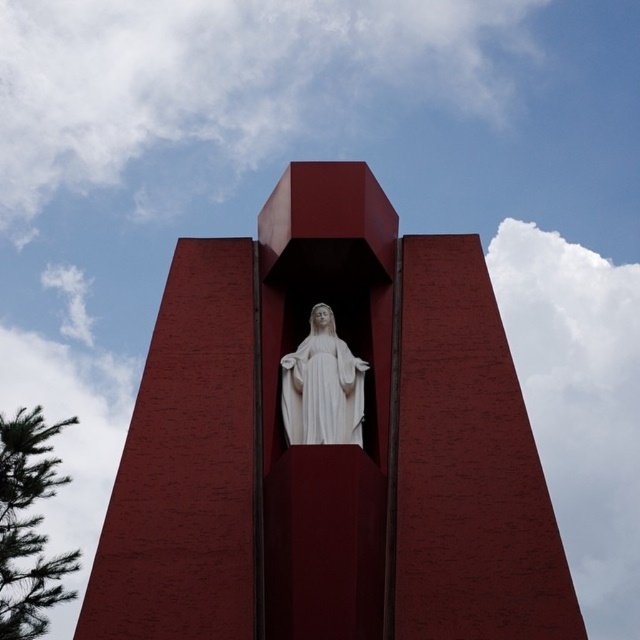
Can you confirm if matte red tower at center is smaller than white marble statue at center?

No, matte red tower at center is not smaller than white marble statue at center.

Is point (445, 310) farther from viewer compared to point (336, 401)?

That is True.

Image resolution: width=640 pixels, height=640 pixels. In order to click on matte red tower at center in this screenshot , I will do `click(330, 445)`.